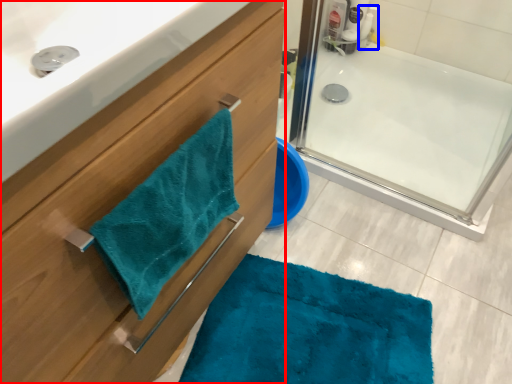
Question: Which point is closer to the camera, bathroom cabinet (highlighted by a red box) or cleaning product (highlighted by a blue box)?

Choices:
 (A) bathroom cabinet
 (B) cleaning product

Answer: (A)